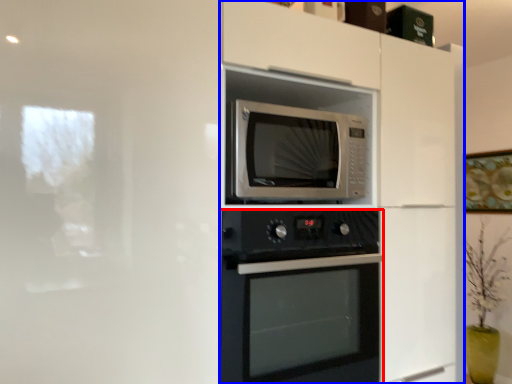
Question: Which object appears closest to the camera in this image, oven (highlighted by a red box) or dresser (highlighted by a blue box)?

Choices:
 (A) oven
 (B) dresser

Answer: (B)